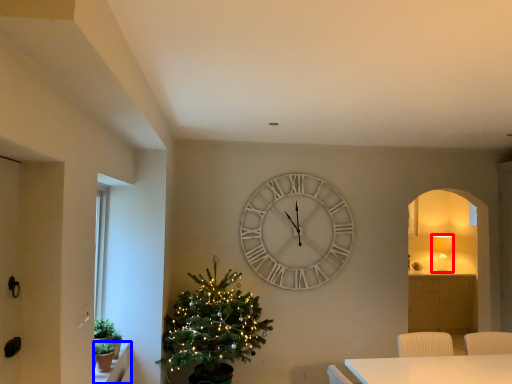
Question: Which object is closer to the camera taking this photo, lamp (highlighted by a red box) or window sill (highlighted by a blue box)?

Choices:
 (A) lamp
 (B) window sill

Answer: (B)